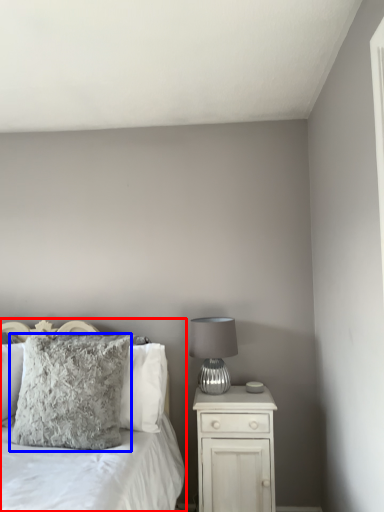
Question: Among these objects, which one is farthest to the camera, bed (highlighted by a red box) or pillow (highlighted by a blue box)?

Choices:
 (A) bed
 (B) pillow

Answer: (B)